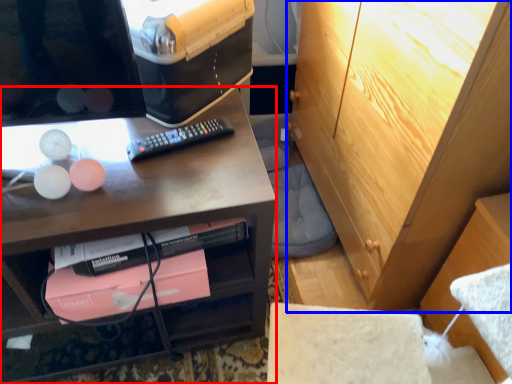
Question: Which object appears closest to the camera in this image, desk (highlighted by a red box) or cabinetry (highlighted by a blue box)?

Choices:
 (A) desk
 (B) cabinetry

Answer: (A)